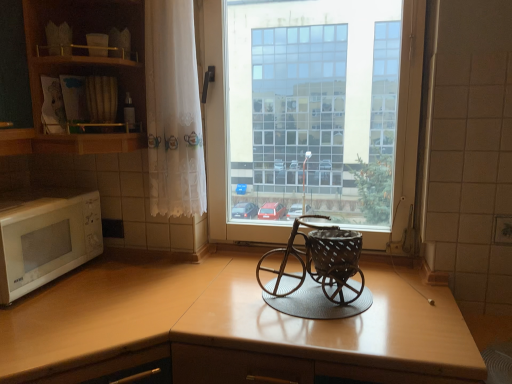
Question: From the image's perspective, is transparent glass window at center positioned above or below wooden cabinet at upper left?

Choices:
 (A) above
 (B) below

Answer: (B)

Question: Is transparent glass window at center bigger or smaller than wooden cabinet at upper left?

Choices:
 (A) big
 (B) small

Answer: (A)

Question: Considering the real-world distances, which object is farthest from the transparent glass window at center?

Choices:
 (A) white matte microwave at left
 (B) light brown laminate counter top at left
 (C) rustic metal bicycle at center
 (D) white lace curtain at left
 (E) wooden at center

Answer: (A)

Question: Which of these objects is positioned farthest from the white lace curtain at left?

Choices:
 (A) transparent glass window at center
 (B) wooden cabinet at upper left
 (C) white matte microwave at left
 (D) light brown laminate counter top at left
 (E) rustic metal bicycle at center

Answer: (E)